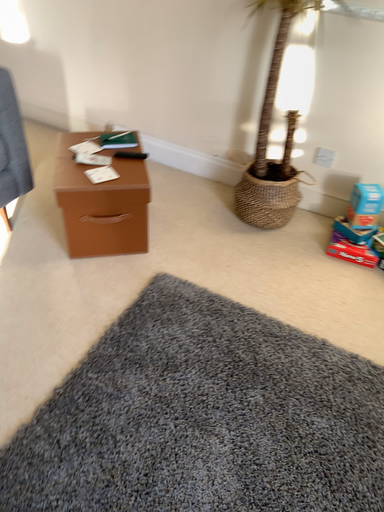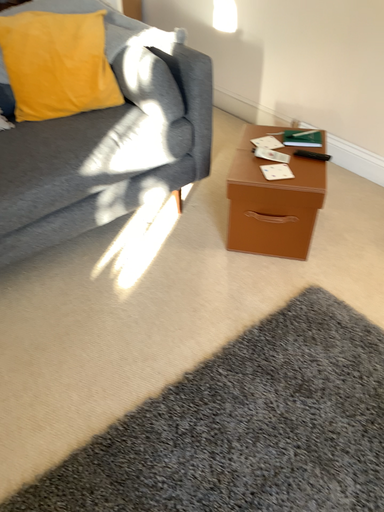
Question: How did the camera likely rotate when shooting the video?

Choices:
 (A) rotated right
 (B) rotated left

Answer: (B)